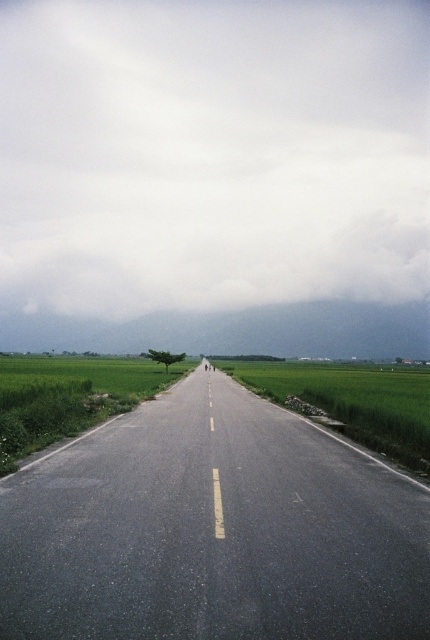
Question: Which object is closer to the camera taking this photo?

Choices:
 (A) green grassy rice field at center
 (B) white fluffy cloud at upper center

Answer: (A)

Question: Can you confirm if white fluffy cloud at upper center is positioned below green grassy rice field at center?

Choices:
 (A) yes
 (B) no

Answer: (B)

Question: Is white fluffy cloud at upper center positioned in front of asphalt road at center?

Choices:
 (A) yes
 (B) no

Answer: (B)

Question: Among these points, which one is farthest from the camera?

Choices:
 (A) (218, 212)
 (B) (427, 316)
 (C) (365, 369)

Answer: (B)

Question: Does white fluffy cloud at upper center appear under green grass at center?

Choices:
 (A) yes
 (B) no

Answer: (B)

Question: Which is nearer to the asphalt road at center?

Choices:
 (A) green grass at center
 (B) green grassy rice field at center
 (C) white fluffy cloud at upper center

Answer: (B)